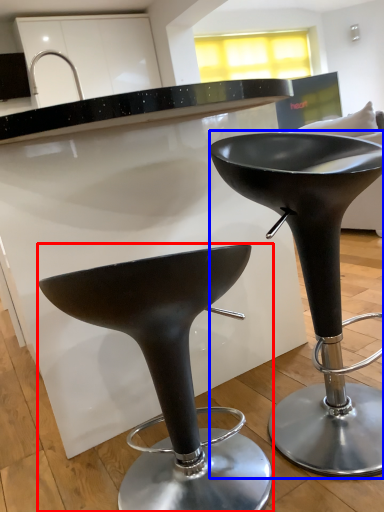
Question: Which object is closer to the camera taking this photo, stool (highlighted by a red box) or stool (highlighted by a blue box)?

Choices:
 (A) stool
 (B) stool

Answer: (A)